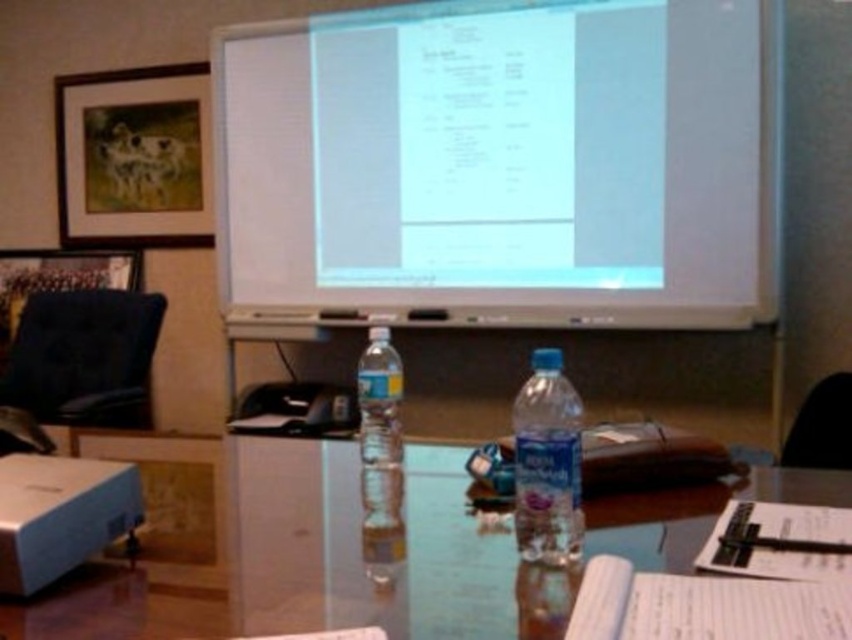
Can you confirm if transparent glass table at center is positioned above black leather chair at right?

No.

What do you see at coordinates (361, 556) in the screenshot? I see `transparent glass table at center` at bounding box center [361, 556].

At what (x,y) coordinates should I click in order to perform the action: click on transparent glass table at center. Please return your answer as a coordinate pair (x, y). The image size is (852, 640). Looking at the image, I should click on (361, 556).

This screenshot has width=852, height=640. I want to click on transparent glass table at center, so click(x=361, y=556).

Is white glossy projector screen at upper center shorter than matte wooden picture frame at upper left?

No, white glossy projector screen at upper center is not shorter than matte wooden picture frame at upper left.

Who is more forward, (x=278, y=182) or (x=106, y=189)?

Point (x=278, y=182) is in front.

Between point (228, 144) and point (68, 113), which one is positioned behind?

The point (68, 113) is behind.

Where is `white glossy projector screen at upper center`? The height and width of the screenshot is (640, 852). white glossy projector screen at upper center is located at coordinates (501, 164).

Is point (4, 458) farther from viewer compared to point (543, 362)?

Yes, it is behind point (543, 362).

Who is more forward, [3,525] or [545,467]?

Positioned in front is point [3,525].

Is point (114, 492) positioned before point (539, 372)?

No.

The image size is (852, 640). What are the coordinates of `matte gray projector at lower left` in the screenshot? It's located at (60, 515).